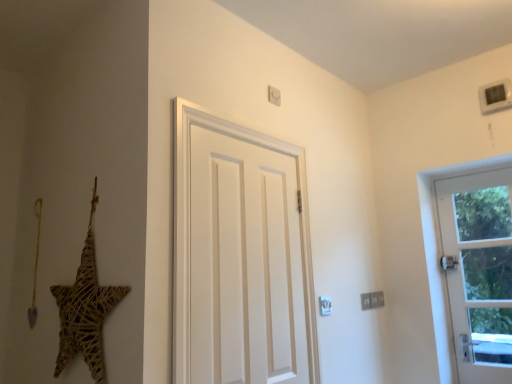
Question: Can we say white matte door at center, which appears as the first door when viewed from the left, lies outside woven straw star at left?

Choices:
 (A) yes
 (B) no

Answer: (A)

Question: From the image's perspective, does white matte door at center, the 2th door in the right-to-left sequence, appear higher than woven straw star at left?

Choices:
 (A) yes
 (B) no

Answer: (A)

Question: Does white matte door at center, which appears as the first door when viewed from the left, have a greater width compared to woven straw star at left?

Choices:
 (A) no
 (B) yes

Answer: (A)

Question: Does white matte door at center, the 2th door in the right-to-left sequence, come in front of woven straw star at left?

Choices:
 (A) yes
 (B) no

Answer: (B)

Question: Is white matte door at center, the 2th door in the right-to-left sequence, facing towards woven straw star at left?

Choices:
 (A) yes
 (B) no

Answer: (B)

Question: From the image's perspective, is white matte door at center, the 2th door in the right-to-left sequence, above or below white glass door at right, which is the 2th door from front to back?

Choices:
 (A) above
 (B) below

Answer: (A)

Question: Which is correct: white matte door at center, which appears as the first door when viewed from the left, is inside white glass door at right, the first door from the right, or outside of it?

Choices:
 (A) inside
 (B) outside

Answer: (B)

Question: Considering the relative positions of white matte door at center, the 1th door in the front-to-back sequence, and white glass door at right, placed as the 2th door when sorted from left to right, in the image provided, is white matte door at center, the 1th door in the front-to-back sequence, to the left or to the right of white glass door at right, placed as the 2th door when sorted from left to right,?

Choices:
 (A) left
 (B) right

Answer: (A)

Question: Relative to white glass door at right, the 1th door positioned from the back, is white matte door at center, placed as the second door when sorted from back to front, in front or behind?

Choices:
 (A) behind
 (B) front

Answer: (B)

Question: Looking at their shapes, would you say woven straw star at left is wider or thinner than white matte door at center, which appears as the first door when viewed from the left?

Choices:
 (A) wide
 (B) thin

Answer: (A)

Question: Considering the positions of point (91, 292) and point (194, 263), is point (91, 292) closer or farther from the camera than point (194, 263)?

Choices:
 (A) closer
 (B) farther

Answer: (A)

Question: Considering the positions of woven straw star at left and white matte door at center, the 2th door in the right-to-left sequence, in the image, is woven straw star at left bigger or smaller than white matte door at center, the 2th door in the right-to-left sequence,?

Choices:
 (A) big
 (B) small

Answer: (A)

Question: From the image's perspective, relative to white matte door at center, the 1th door in the front-to-back sequence, is woven straw star at left above or below?

Choices:
 (A) below
 (B) above

Answer: (A)

Question: Relative to woven straw star at left, is white glass door at right, which is the 2th door from front to back, in front or behind?

Choices:
 (A) behind
 (B) front

Answer: (A)

Question: Is white glass door at right, the first door from the right, wider or thinner than woven straw star at left?

Choices:
 (A) wide
 (B) thin

Answer: (A)